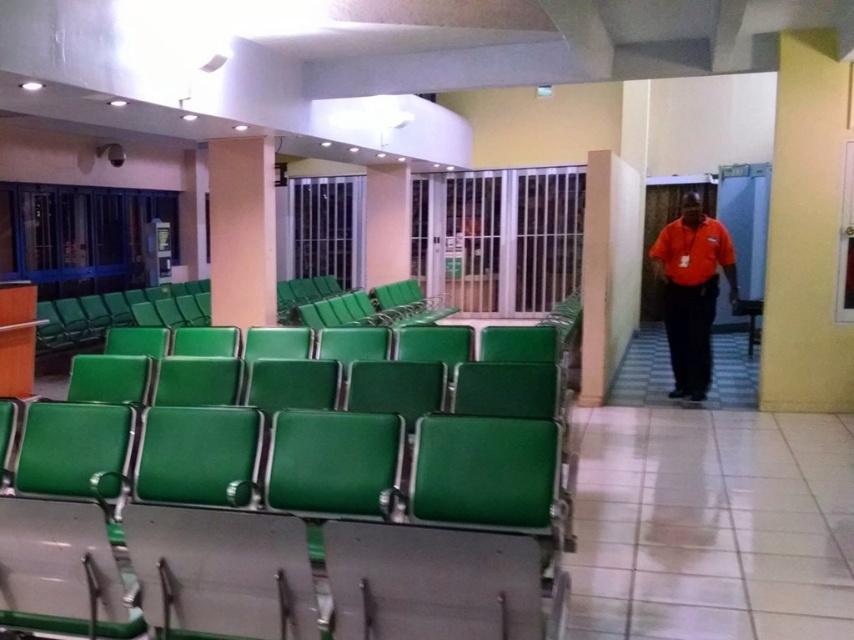
Which is more to the right, matte green pillar at upper center or white glossy pillar at center?

Positioned to the right is white glossy pillar at center.

Is point (268, 234) positioned after point (390, 282)?

That is False.

This screenshot has width=854, height=640. I want to click on matte green pillar at upper center, so click(x=241, y=230).

Which is in front, point (600, 380) or point (383, 170)?

Point (600, 380) is in front.

Image resolution: width=854 pixels, height=640 pixels. What are the coordinates of `green painted concrete pillar at right` in the screenshot? It's located at (607, 269).

Is point (613, 253) farther from viewer compared to point (375, 184)?

No, it is in front of (375, 184).

Find the location of a particular element. The width and height of the screenshot is (854, 640). green painted concrete pillar at right is located at coordinates (607, 269).

Between green painted concrete pillar at right and orange shirt at center, which one appears on the left side from the viewer's perspective?

Positioned to the left is green painted concrete pillar at right.

Who is lower down, green painted concrete pillar at right or orange shirt at center?

orange shirt at center is lower down.

Which is behind, point (607, 161) or point (686, 198)?

The point (686, 198) is more distant.

Identify the location of green painted concrete pillar at right. This screenshot has width=854, height=640. (607, 269).